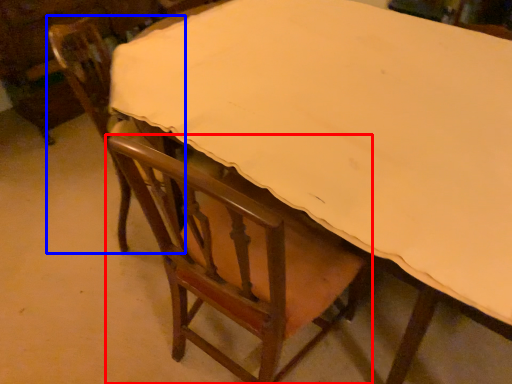
Question: Among these objects, which one is nearest to the camera, chair (highlighted by a red box) or chair (highlighted by a blue box)?

Choices:
 (A) chair
 (B) chair

Answer: (A)